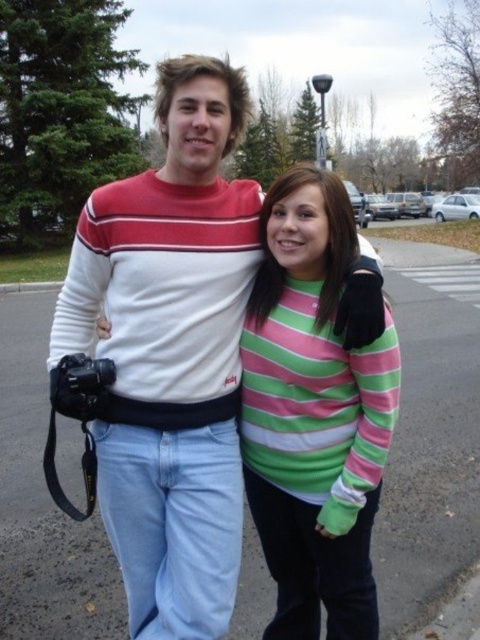
Question: Which object is closer to the camera taking this photo?

Choices:
 (A) striped cotton sweater at center
 (B) white striped sweater at center

Answer: (A)

Question: Is white striped sweater at center wider than striped cotton sweater at center?

Choices:
 (A) no
 (B) yes

Answer: (B)

Question: Is white striped sweater at center in front of striped cotton sweater at center?

Choices:
 (A) yes
 (B) no

Answer: (B)

Question: Does white striped sweater at center appear over striped cotton sweater at center?

Choices:
 (A) yes
 (B) no

Answer: (A)